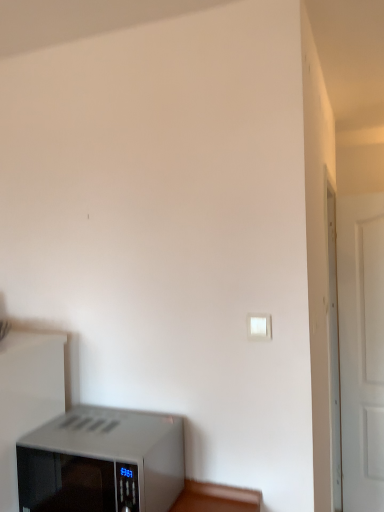
You are a GUI agent. You are given a task and a screenshot of the screen. Output one action in this format:
    pyautogui.click(x=<x>, y=<y>)
    Task: Click on the vacant space situated above satin silver microwave at lower left (from a real-world perspective)
    The image size is (384, 512).
    Given the screenshot: What is the action you would take?
    pyautogui.click(x=108, y=434)